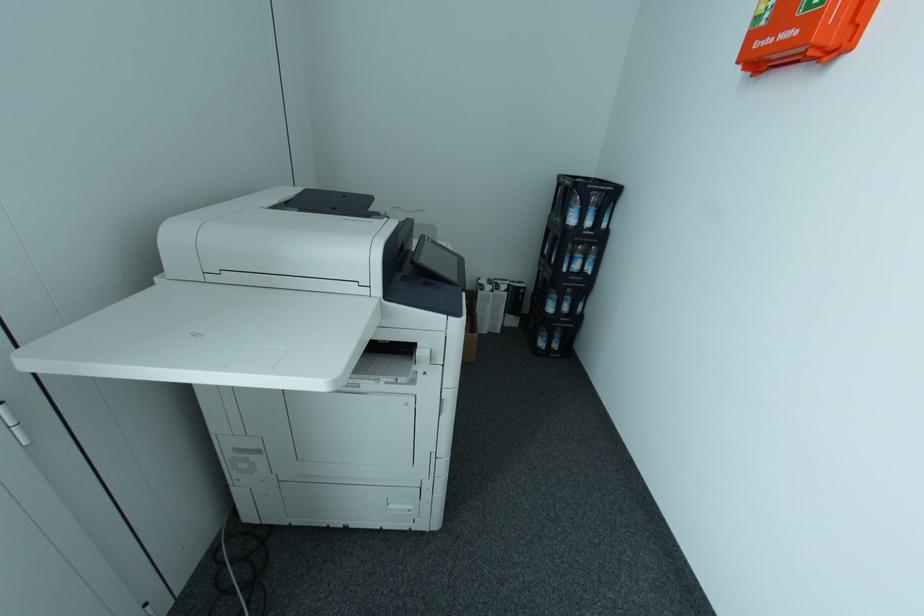
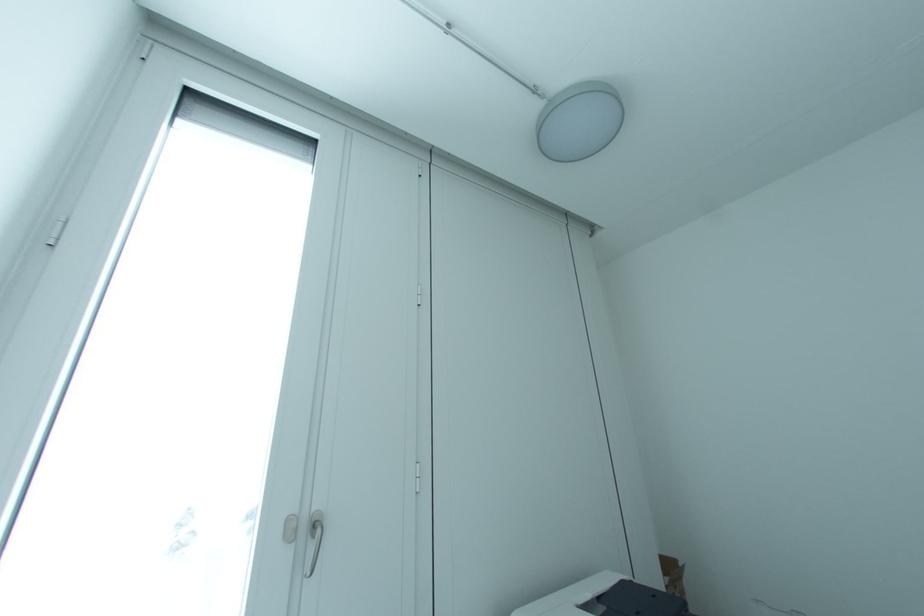
The first image is from the beginning of the video and the second image is from the end. How did the camera likely rotate when shooting the video?

The camera's rotation is toward left-up.